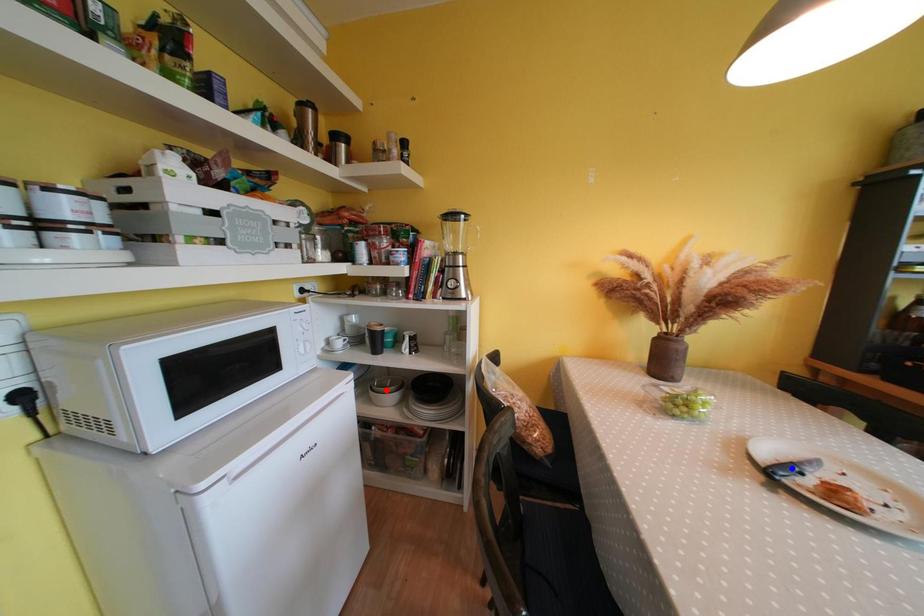
Question: Which of the two points in the image is closer to the camera?

Choices:
 (A) Blue point is closer.
 (B) Red point is closer.

Answer: (A)